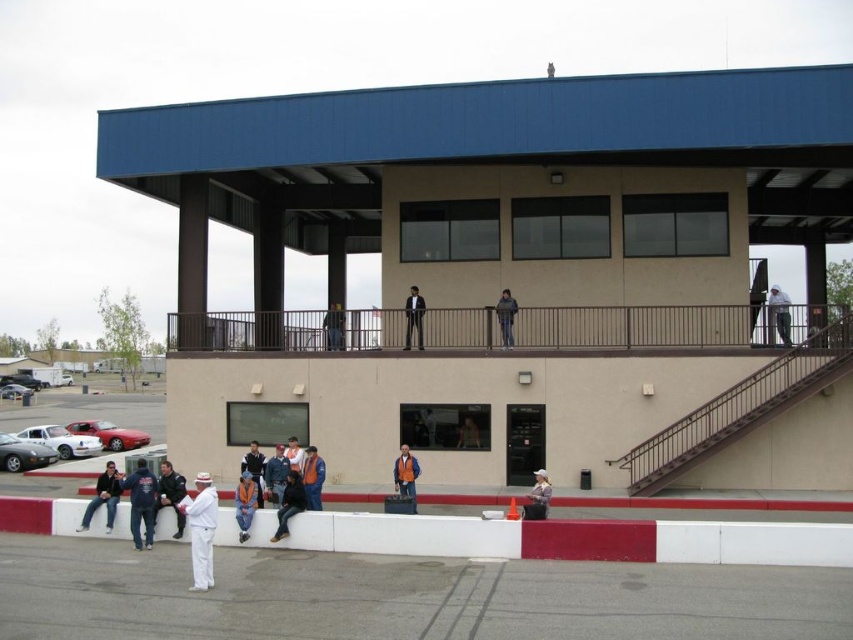
You are standing at the point marked as point [201,531]. What object is located at this point?

The point [201,531] corresponds to the white cotton suit at lower left.

In the scene shown: You are a photographer trying to capture the scene. You notice the white cotton suit at lower left and the gray fabric jacket at upper right. Which clothing item would appear more detailed in a closeup photo taken from your current position?

The white cotton suit at lower left would appear more detailed in a closeup photo because it is thinner than the gray fabric jacket at upper right, allowing for finer texture visibility.

You are organizing a photo shoot and need to determine which clothing item takes up more visual space in the image. Based on the scene, which item is larger between the denim jacket at lower center and the white cotton shirt at lower center?

The denim jacket at lower center is larger in size than the white cotton shirt at lower center, so it takes up more visual space.